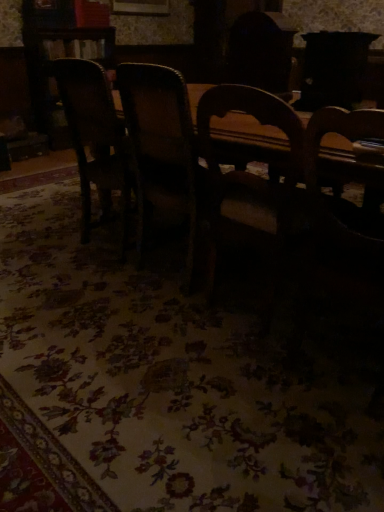
At what (x,y) coordinates should I click in order to perform the action: click on wooden chair at center, which ranks as the second chair in left-to-right order. Please return your answer as a coordinate pair (x, y). This screenshot has height=512, width=384. Looking at the image, I should click on [x=163, y=148].

Image resolution: width=384 pixels, height=512 pixels. What do you see at coordinates (163, 148) in the screenshot?
I see `wooden chair at center, which ranks as the second chair in left-to-right order` at bounding box center [163, 148].

This screenshot has width=384, height=512. Identify the location of wooden chair at left, acting as the second chair starting from the right. (94, 138).

Image resolution: width=384 pixels, height=512 pixels. What do you see at coordinates (94, 138) in the screenshot? I see `wooden chair at left, marked as the first chair in a left-to-right arrangement` at bounding box center [94, 138].

Where is `wooden chair at center, which ranks as the second chair in left-to-right order`? wooden chair at center, which ranks as the second chair in left-to-right order is located at coordinates (163, 148).

Which object is positioned more to the right, wooden chair at center, which ranks as the second chair in left-to-right order, or wooden chair at left, acting as the second chair starting from the right?

wooden chair at center, which ranks as the second chair in left-to-right order, is more to the right.

Between wooden chair at center, which ranks as the second chair in left-to-right order, and wooden chair at left, marked as the first chair in a left-to-right arrangement, which one is positioned in front?

wooden chair at center, which ranks as the second chair in left-to-right order, is in front.

Is point (195, 165) positioned after point (95, 123)?

No, it is not.

From the image's perspective, who appears lower, wooden chair at center, the first chair viewed from the right, or wooden chair at left, marked as the first chair in a left-to-right arrangement?

wooden chair at center, the first chair viewed from the right.

From a real-world perspective, which is physically above, wooden chair at center, the first chair viewed from the right, or wooden chair at left, marked as the first chair in a left-to-right arrangement?

In real-world perspective, wooden chair at center, the first chair viewed from the right, is above.

Looking at their sizes, would you say wooden chair at center, the first chair viewed from the right, is wider or thinner than wooden chair at left, acting as the second chair starting from the right?

In the image, wooden chair at center, the first chair viewed from the right, appears to be wider than wooden chair at left, acting as the second chair starting from the right.

Is wooden chair at center, which ranks as the second chair in left-to-right order, taller than wooden chair at left, acting as the second chair starting from the right?

Yes.

From the picture: Between wooden chair at center, which ranks as the second chair in left-to-right order, and wooden chair at left, marked as the first chair in a left-to-right arrangement, which one has larger size?

Bigger between the two is wooden chair at center, which ranks as the second chair in left-to-right order.

Do you think wooden chair at center, which ranks as the second chair in left-to-right order, is within wooden chair at left, acting as the second chair starting from the right, or outside of it?

wooden chair at center, which ranks as the second chair in left-to-right order, cannot be found inside wooden chair at left, acting as the second chair starting from the right.

Is wooden chair at center, the first chair viewed from the right, with wooden chair at left, marked as the first chair in a left-to-right arrangement?

No.

Consider the image. Does wooden chair at center, which ranks as the second chair in left-to-right order, turn towards wooden chair at left, marked as the first chair in a left-to-right arrangement?

No, wooden chair at center, which ranks as the second chair in left-to-right order, is not turned towards wooden chair at left, marked as the first chair in a left-to-right arrangement.

Can you tell me how much wooden chair at center, the first chair viewed from the right, and wooden chair at left, acting as the second chair starting from the right, differ in facing direction?

The facing directions of wooden chair at center, the first chair viewed from the right, and wooden chair at left, acting as the second chair starting from the right, are 2.22 degrees apart.

In order to click on chair that is above the wooden chair at left, acting as the second chair starting from the right (from a real-world perspective) in this screenshot , I will do `click(163, 148)`.

Between wooden chair at left, marked as the first chair in a left-to-right arrangement, and wooden chair at center, the first chair viewed from the right, which one appears on the right side from the viewer's perspective?

Positioned to the right is wooden chair at center, the first chair viewed from the right.

Relative to wooden chair at center, the first chair viewed from the right, is wooden chair at left, acting as the second chair starting from the right, in front or behind?

Visually, wooden chair at left, acting as the second chair starting from the right, is located behind wooden chair at center, the first chair viewed from the right.

Between point (85, 62) and point (164, 165), which one is positioned behind?

The point (164, 165) is more distant.

From the image's perspective, is wooden chair at left, acting as the second chair starting from the right, under wooden chair at center, which ranks as the second chair in left-to-right order?

No.

From a real-world perspective, is wooden chair at left, marked as the first chair in a left-to-right arrangement, physically located above or below wooden chair at center, the first chair viewed from the right?

wooden chair at left, marked as the first chair in a left-to-right arrangement, is below wooden chair at center, the first chair viewed from the right.

Considering the relative sizes of wooden chair at left, marked as the first chair in a left-to-right arrangement, and wooden chair at center, which ranks as the second chair in left-to-right order, in the image provided, is wooden chair at left, marked as the first chair in a left-to-right arrangement, wider than wooden chair at center, which ranks as the second chair in left-to-right order,?

No.

Considering the relative sizes of wooden chair at left, marked as the first chair in a left-to-right arrangement, and wooden chair at center, which ranks as the second chair in left-to-right order, in the image provided, is wooden chair at left, marked as the first chair in a left-to-right arrangement, shorter than wooden chair at center, which ranks as the second chair in left-to-right order,?

Correct, wooden chair at left, marked as the first chair in a left-to-right arrangement, is not as tall as wooden chair at center, which ranks as the second chair in left-to-right order.

Which of these two, wooden chair at left, acting as the second chair starting from the right, or wooden chair at center, the first chair viewed from the right, is bigger?

Bigger between the two is wooden chair at center, the first chair viewed from the right.

Choose the correct answer: Is wooden chair at left, marked as the first chair in a left-to-right arrangement, inside wooden chair at center, the first chair viewed from the right, or outside it?

wooden chair at left, marked as the first chair in a left-to-right arrangement, is not enclosed by wooden chair at center, the first chair viewed from the right.

Are wooden chair at left, marked as the first chair in a left-to-right arrangement, and wooden chair at center, which ranks as the second chair in left-to-right order, far apart?

No.

Is wooden chair at left, marked as the first chair in a left-to-right arrangement, turned away from wooden chair at center, which ranks as the second chair in left-to-right order?

No.

This screenshot has width=384, height=512. What are the coordinates of `chair on the right of the wooden chair at left, acting as the second chair starting from the right` in the screenshot? It's located at (163, 148).

At what (x,y) coordinates should I click in order to perform the action: click on chair that is below the wooden chair at left, marked as the first chair in a left-to-right arrangement (from the image's perspective). Please return your answer as a coordinate pair (x, y). Looking at the image, I should click on (163, 148).

This screenshot has height=512, width=384. Find the location of `chair on the left of wooden chair at center, which ranks as the second chair in left-to-right order`. chair on the left of wooden chair at center, which ranks as the second chair in left-to-right order is located at coordinates (94, 138).